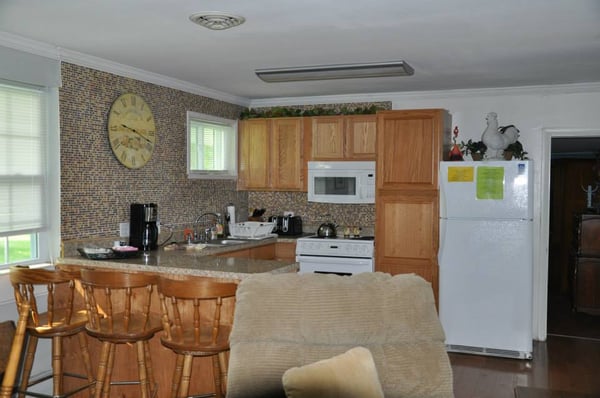
Where is `microwave`? This screenshot has height=398, width=600. microwave is located at coordinates (341, 176).